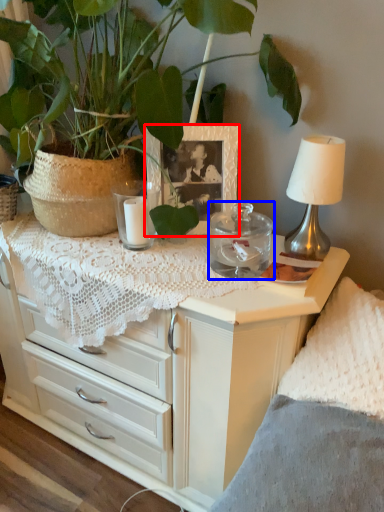
Question: Which object is further to the camera taking this photo, picture frame (highlighted by a red box) or candle holder (highlighted by a blue box)?

Choices:
 (A) picture frame
 (B) candle holder

Answer: (A)